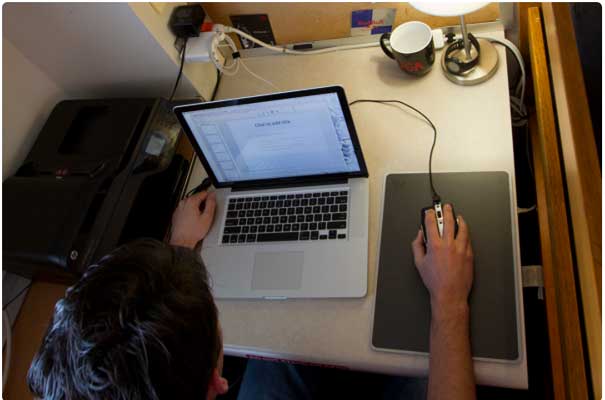
Locate an element on the screen. white desk top is located at coordinates (459, 111).